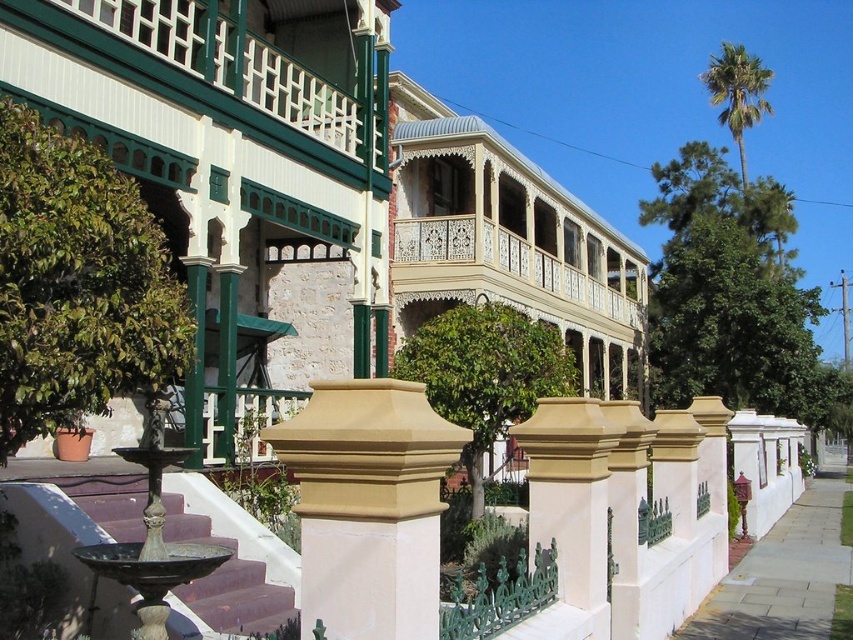
Question: Does slate gray paving stone at lower right appear under green leafy palm at upper right?

Choices:
 (A) yes
 (B) no

Answer: (A)

Question: Can you confirm if slate gray paving stone at lower right is positioned to the left of white painted wood at upper center?

Choices:
 (A) yes
 (B) no

Answer: (B)

Question: Is white painted wood at upper center bigger than green leafy palm at upper right?

Choices:
 (A) yes
 (B) no

Answer: (B)

Question: Considering the real-world distances, which object is farthest from the sandy beige stone fence post at center?

Choices:
 (A) beige smooth post at center
 (B) slate gray paving stone at lower right

Answer: (B)

Question: Which object is the closest to the green leafy palm at upper right?

Choices:
 (A) white painted wood at upper center
 (B) slate gray paving stone at lower right
 (C) white painted wood balcony at upper center

Answer: (C)

Question: Among these objects, which one is farthest from the camera?

Choices:
 (A) white painted wood balcony at upper center
 (B) sandy beige stone fence post at center
 (C) slate gray paving stone at lower right
 (D) beige smooth post at center

Answer: (A)